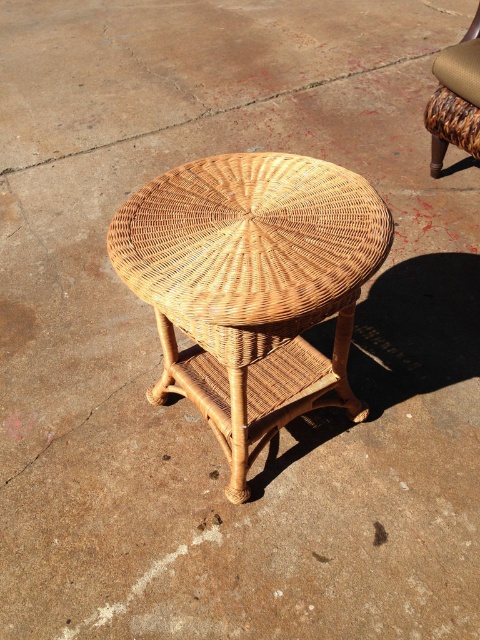
Measure the distance between natural wicker side table at center and woven brown chair at center.

natural wicker side table at center is 3.94 feet from woven brown chair at center.

Does natural wicker side table at center have a greater width compared to woven brown chair at center?

Correct, the width of natural wicker side table at center exceeds that of woven brown chair at center.

The height and width of the screenshot is (640, 480). What do you see at coordinates (252, 285) in the screenshot?
I see `natural wicker side table at center` at bounding box center [252, 285].

Locate an element on the screen. natural wicker side table at center is located at coordinates (252, 285).